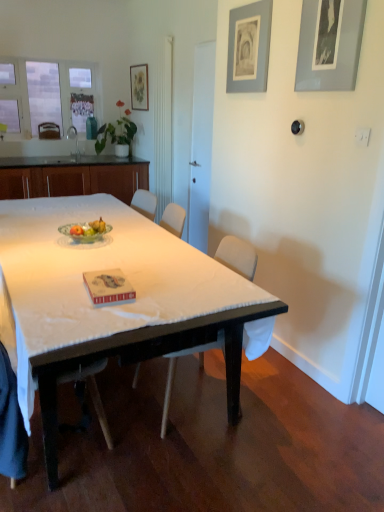
Question: In which direction should I rotate to look at white wood chair at center, the first chair from the bottom?

Choices:
 (A) left
 (B) right

Answer: (A)

Question: Considering the relative positions of white plastic chair at center, the first chair from the right, and wooden at left, arranged as the first chair when viewed from the top, in the image provided, is white plastic chair at center, the first chair from the right, in front of wooden at left, arranged as the first chair when viewed from the top,?

Choices:
 (A) no
 (B) yes

Answer: (B)

Question: Does white plastic chair at center, the first chair from the right, have a larger size compared to wooden at left, which ranks as the first chair in back-to-front order?

Choices:
 (A) yes
 (B) no

Answer: (A)

Question: Is white plastic chair at center, which ranks as the third chair in left-to-right order, touching wooden at left, marked as the 3th chair in a right-to-left arrangement?

Choices:
 (A) no
 (B) yes

Answer: (A)

Question: Is white plastic chair at center, the first chair from the right, not close to wooden at left, which ranks as the first chair in back-to-front order?

Choices:
 (A) yes
 (B) no

Answer: (A)

Question: Can you confirm if white plastic chair at center, which ranks as the third chair in left-to-right order, is thinner than wooden at left, which ranks as the first chair in back-to-front order?

Choices:
 (A) yes
 (B) no

Answer: (B)

Question: Is white plastic chair at center, the first chair from the right, at the left side of wooden at left, positioned as the 3th chair in front-to-back order?

Choices:
 (A) yes
 (B) no

Answer: (B)

Question: Is white matte table at center further to camera compared to gray matte picture frame at upper right, positioned as the 1th picture frame in bottom-to-top order?

Choices:
 (A) yes
 (B) no

Answer: (B)

Question: From a real-world perspective, does white matte table at center stand above gray matte picture frame at upper right, which appears as the 3th picture frame when viewed from the top?

Choices:
 (A) yes
 (B) no

Answer: (B)

Question: From the image's perspective, does white matte table at center appear lower than gray matte picture frame at upper right, acting as the 3th picture frame starting from the back?

Choices:
 (A) yes
 (B) no

Answer: (A)

Question: Does white matte table at center have a greater width compared to gray matte picture frame at upper right, which is the third picture frame in left-to-right order?

Choices:
 (A) no
 (B) yes

Answer: (B)

Question: Is white matte table at center completely or partially outside of gray matte picture frame at upper right, the first picture frame viewed from the front?

Choices:
 (A) yes
 (B) no

Answer: (A)

Question: Is white matte table at center to the right of gray matte picture frame at upper right, acting as the 3th picture frame starting from the back, from the viewer's perspective?

Choices:
 (A) yes
 (B) no

Answer: (B)

Question: Does wooden cabinet at left turn towards white wood chair at center, the 1th chair in the front-to-back sequence?

Choices:
 (A) yes
 (B) no

Answer: (A)